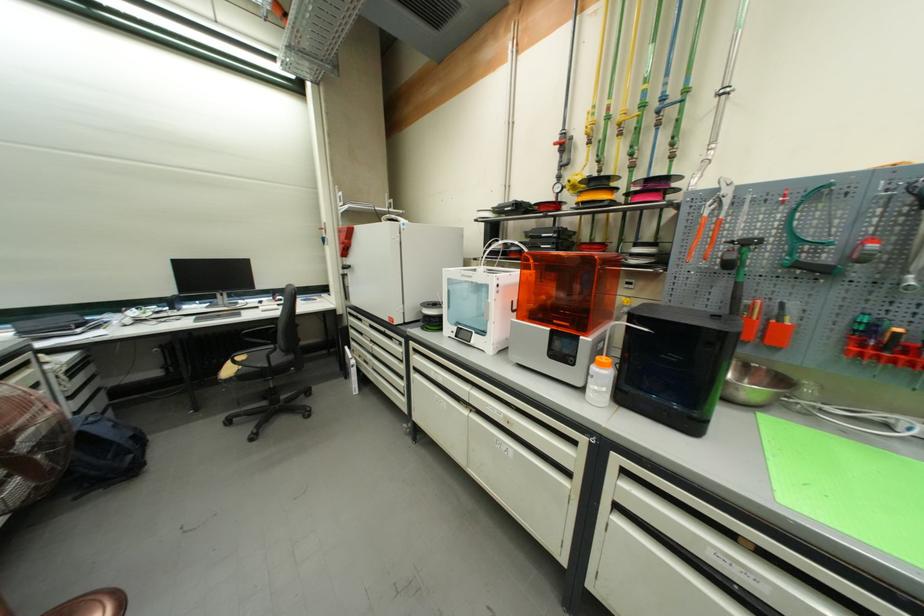
I want to click on black chair armrest, so click(253, 357).